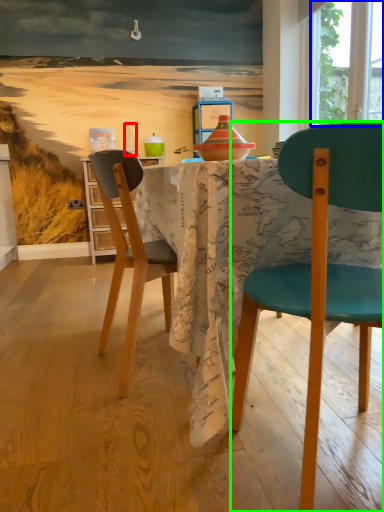
Question: Which object is positioned closest to bottle (highlighted by a red box)? Select from window screen (highlighted by a blue box) and chair (highlighted by a green box).

Choices:
 (A) window screen
 (B) chair

Answer: (A)